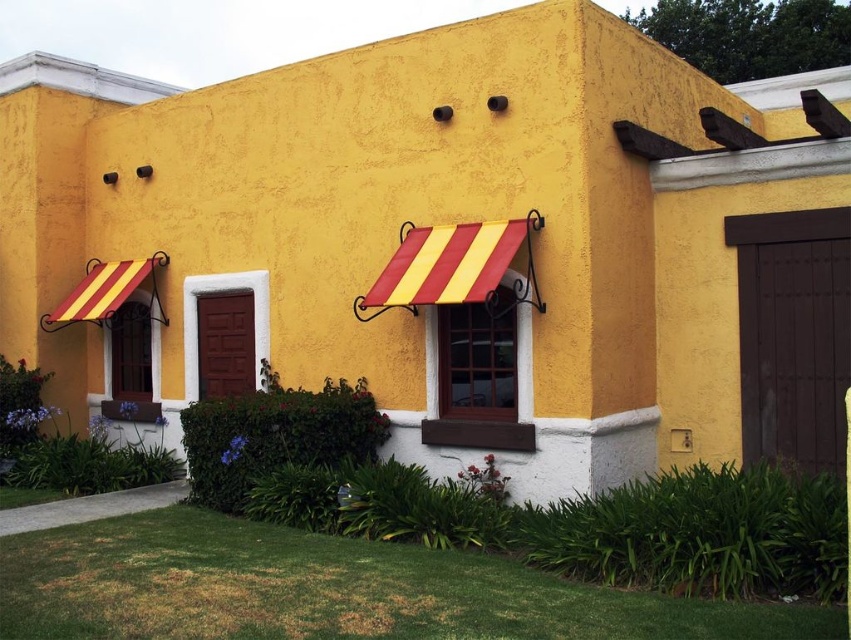
You are a delivery person trying to enter the building. You have a large package that requires a door at least 3 feet wide. Which door, the brown wooden door at right or the matte wood door at center, should you use?

The brown wooden door at right is larger in size than the matte wood door at center, so you should use the brown wooden door at right to accommodate your large package.

You are standing at point (221, 330) and want to walk to the building entrance located at point 0.261, 0.517. Given that the path between them is 36.13 feet long, will you be able to reach the entrance within 10 seconds if you walk at a speed of 3 feet per second?

The distance between point (221, 330) and point 0.261, 0.517 is 36.13 feet. Walking at 3 feet per second, it would take 12.04 seconds to cover this distance. Therefore, you will not reach the entrance within 10 seconds.

You are standing in front of the building and want to enter through the brown wooden door at right. There is a yellow striped awning at left nearby. Which object is closer to you?

The brown wooden door at right is closer to the viewer than the yellow striped awning at left.